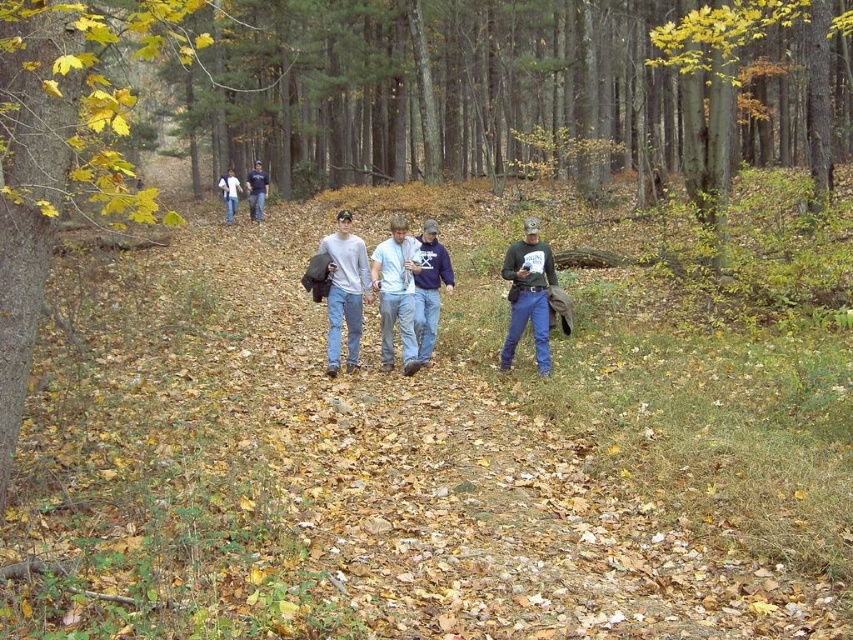
Measure the distance between matte green shirt at center and camera.

matte green shirt at center is 31.57 feet away from camera.

What do you see at coordinates (527, 294) in the screenshot? This screenshot has height=640, width=853. I see `matte green shirt at center` at bounding box center [527, 294].

Between point (543, 304) and point (329, 369), which one is positioned in front?

Positioned in front is point (543, 304).

You are a GUI agent. You are given a task and a screenshot of the screen. Output one action in this format:
    pyautogui.click(x=<x>, y=<y>)
    Task: Click on the matte green shirt at center
    
    Given the screenshot: What is the action you would take?
    pyautogui.click(x=527, y=294)

Can you confirm if suede-like navy blue hoodie at center is positioned below white cotton shirt at upper center?

Indeed, suede-like navy blue hoodie at center is positioned under white cotton shirt at upper center.

Is suede-like navy blue hoodie at center behind white cotton shirt at upper center?

No, suede-like navy blue hoodie at center is closer to the viewer.

What do you see at coordinates (428, 288) in the screenshot? I see `suede-like navy blue hoodie at center` at bounding box center [428, 288].

Locate an element on the screen. suede-like navy blue hoodie at center is located at coordinates (428, 288).

Is light gray cotton shirt at center closer to camera compared to blue cotton shirt at center?

Yes.

Can you confirm if light gray cotton shirt at center is positioned below blue cotton shirt at center?

Yes, light gray cotton shirt at center is below blue cotton shirt at center.

At what (x,y) coordinates should I click in order to perform the action: click on light gray cotton shirt at center. Please return your answer as a coordinate pair (x, y). The width and height of the screenshot is (853, 640). Looking at the image, I should click on (344, 289).